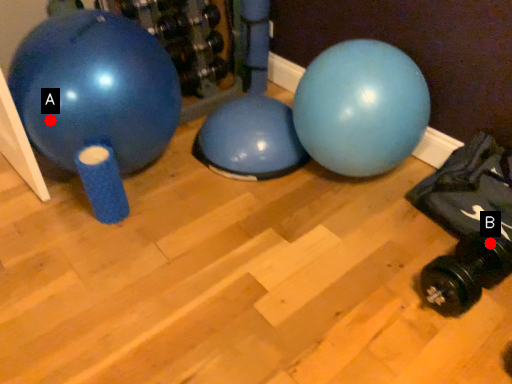
Question: Two points are circled on the image, labeled by A and B beside each circle. Which point appears closest to the camera in this image?

Choices:
 (A) A is closer
 (B) B is closer

Answer: (A)